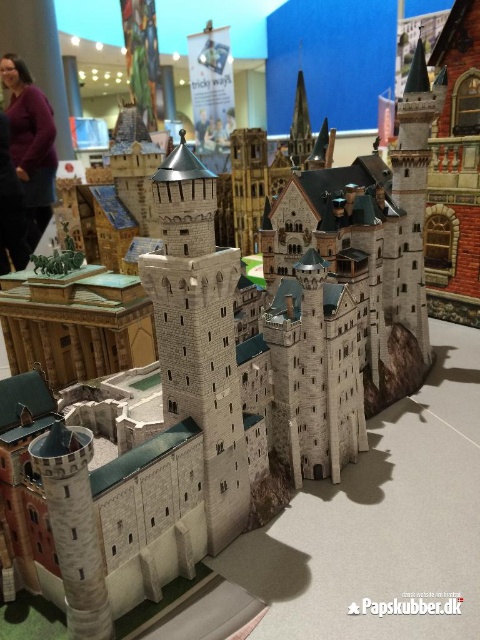
You are a visitor at a model castle exhibit and notice the stone tower at center and the purple matte sweater at upper left. Which object is higher in height?

The stone tower at center is taller than the purple matte sweater at upper left.

You are an architect designing a new exhibition layout. You need to place the stone tower at center and the purple matte sweater at upper left in such a way that they are exactly 6.78 meters apart. Given that the exhibition hall has a maximum allowable distance of 7 meters between any two exhibits, will your placement comply with the space constraints?

The stone tower at center and purple matte sweater at upper left are 6.78 meters apart, which is under the 7 meters maximum allowable distance. Therefore, the placement complies with the space constraints.